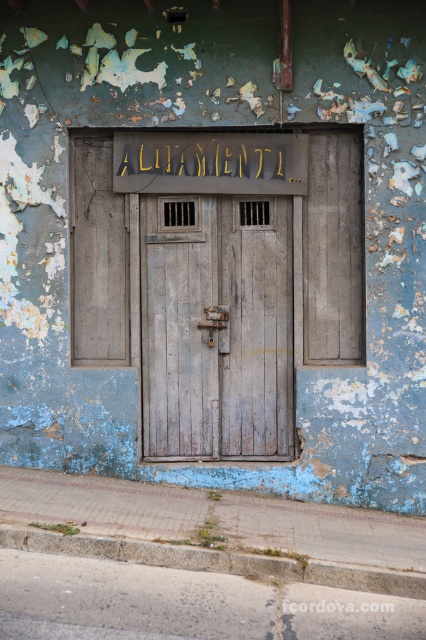
Question: Which object appears closest to the camera in this image?

Choices:
 (A) weathered wood door at center
 (B) gold metallic sign at upper center

Answer: (B)

Question: Can you confirm if weathered wood door at center is bigger than gold metallic sign at upper center?

Choices:
 (A) yes
 (B) no

Answer: (A)

Question: Which point is farther to the camera?

Choices:
 (A) (169, 168)
 (B) (229, 372)

Answer: (B)

Question: Which object is farther from the camera taking this photo?

Choices:
 (A) weathered wood door at center
 (B) gold metallic sign at upper center

Answer: (A)

Question: Is weathered wood door at center further to camera compared to gold metallic sign at upper center?

Choices:
 (A) no
 (B) yes

Answer: (B)

Question: In this image, where is weathered wood door at center located relative to gold metallic sign at upper center?

Choices:
 (A) right
 (B) left

Answer: (A)